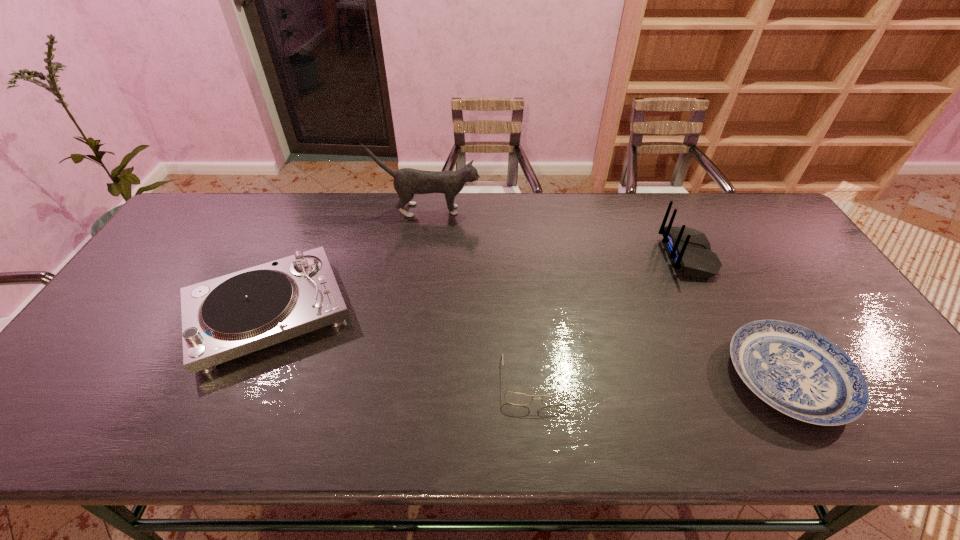
Where is `vacant space at the far left corner of the desktop`? The height and width of the screenshot is (540, 960). vacant space at the far left corner of the desktop is located at coordinates (202, 219).

Identify the location of free space at the far right corner of the desktop. The width and height of the screenshot is (960, 540). (747, 194).

In order to click on unoccupied area between the plate and the tallest object in this screenshot , I will do `click(608, 294)`.

Where is `free spot between the spectacles and the record player`? Image resolution: width=960 pixels, height=540 pixels. free spot between the spectacles and the record player is located at coordinates (401, 347).

Locate an element on the screen. Image resolution: width=960 pixels, height=540 pixels. unoccupied position between the fourth shortest object and the farthest object is located at coordinates (558, 233).

This screenshot has height=540, width=960. Identify the location of free space between the router and the record player. (478, 284).

Where is `vacant region between the spectacles and the record player`? The width and height of the screenshot is (960, 540). vacant region between the spectacles and the record player is located at coordinates (401, 347).

The image size is (960, 540). I want to click on free spot between the record player and the second tallest object, so click(x=478, y=284).

The width and height of the screenshot is (960, 540). I want to click on vacant area that lies between the third object from left to right and the plate, so click(661, 379).

The image size is (960, 540). What are the coordinates of `vacant space that is in between the plate and the fourth shortest object` in the screenshot? It's located at (738, 316).